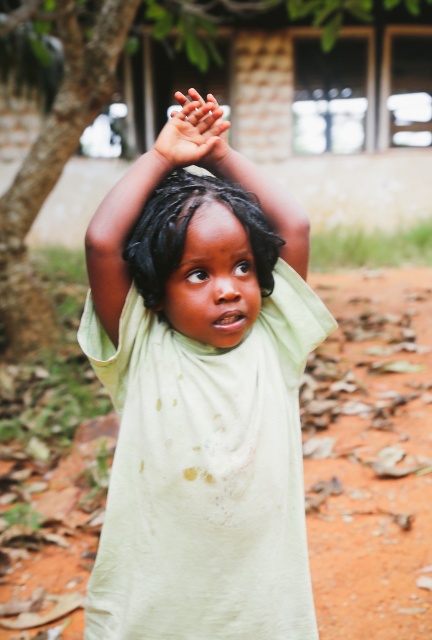
In the scene shown: Measure the distance between point (269, 598) and camera.

Point (269, 598) and camera are 5.58 feet apart.

This screenshot has width=432, height=640. Find the location of `light green fabric at center`. light green fabric at center is located at coordinates (202, 404).

Which is in front, point (190, 444) or point (181, 136)?

Point (190, 444) is in front.

In order to click on light green fabric at center in this screenshot , I will do `click(202, 404)`.

Locate an element on the screen. This screenshot has height=640, width=432. light green fabric at center is located at coordinates (202, 404).

Does green leafy tree at upper left have a larger size compared to smooth skin hands at upper center?

Correct, green leafy tree at upper left is larger in size than smooth skin hands at upper center.

Is green leafy tree at upper left shorter than smooth skin hands at upper center?

No, green leafy tree at upper left is not shorter than smooth skin hands at upper center.

Between point (91, 61) and point (174, 141), which one is positioned in front?

Point (174, 141) is more forward.

You are a GUI agent. You are given a task and a screenshot of the screen. Output one action in this format:
    pyautogui.click(x=<x>, y=<y>)
    Task: Click on the green leafy tree at upper left
    Image resolution: width=432 pixels, height=640 pixels.
    Given the screenshot: What is the action you would take?
    click(x=54, y=161)